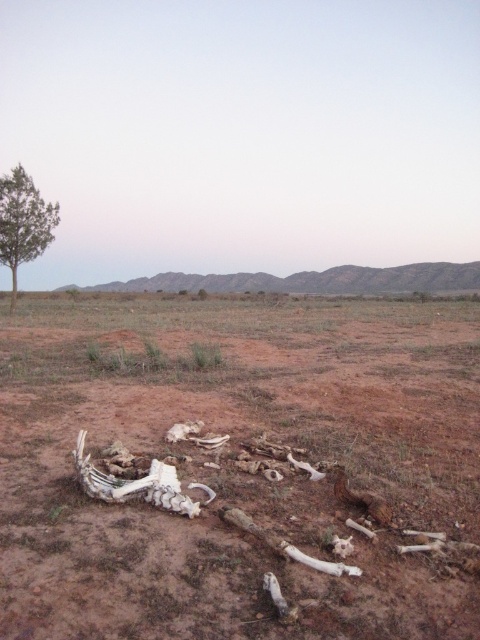
You are a hiker lost in the desert and see the brown dirt field at center and the green leafy tree at left. Which direction should you walk to reach the tree from the field?

The brown dirt field at center is positioned on the right side of green leafy tree at left, so you should walk to the left to reach the green leafy tree at left from the brown dirt field at center.

You are a hiker trying to cross the brown dirt field at center and the green leafy tree at left. Which path would allow you to travel further without encountering obstacles?

The brown dirt field at center might be wider than the green leafy tree at left, so choosing the path through the brown dirt field at center would likely allow you to travel further without obstacles.

You are a photographer trying to capture the landscape. You notice two points in the image, point 1 at coordinates point [143,422] and point 2 at coordinates point [49,232]. Which point is closer to the camera?

Point [143,422] is closer to the camera than point [49,232].